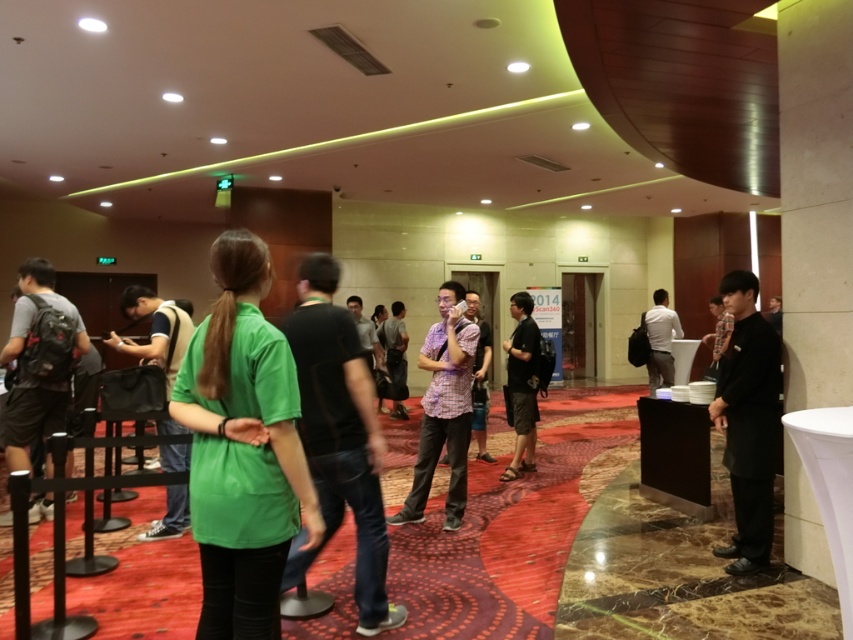
Who is positioned more to the left, dark green t-shirt at center or black matte jacket at right?

A: From the viewer's perspective, dark green t-shirt at center appears more on the left side.

Is point (376, 528) positioned before point (749, 412)?

Yes, point (376, 528) is in front of point (749, 412).

Locate an element on the screen. This screenshot has height=640, width=853. dark green t-shirt at center is located at coordinates click(x=339, y=436).

Consider the image. Can you confirm if green matte shirt at center is bigger than green fabric shirt at center?

Actually, green matte shirt at center might be smaller than green fabric shirt at center.

Identify the location of green matte shirt at center. (242, 448).

This screenshot has height=640, width=853. What are the coordinates of `green matte shirt at center` in the screenshot? It's located at (242, 448).

Which is behind, point (267, 436) or point (726, 556)?

The point (726, 556) is behind.

Is green matte shirt at center shorter than black matte jacket at right?

Yes.

Is point (239, 616) farther from camera compared to point (759, 372)?

No, it is in front of (759, 372).

Find the location of a particular element. green matte shirt at center is located at coordinates (242, 448).